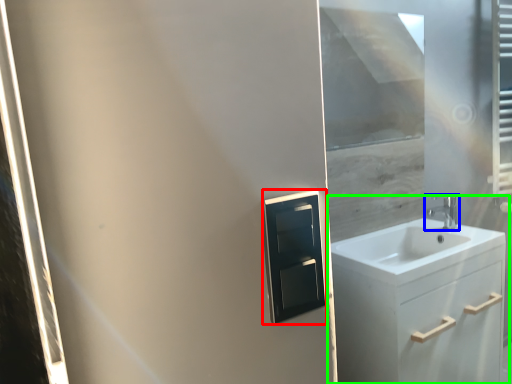
Question: Which object is positioned closest to medicine cabinet (highlighted by a red box)? Select from tap (highlighted by a blue box) and bathroom cabinet (highlighted by a green box).

Choices:
 (A) tap
 (B) bathroom cabinet

Answer: (B)